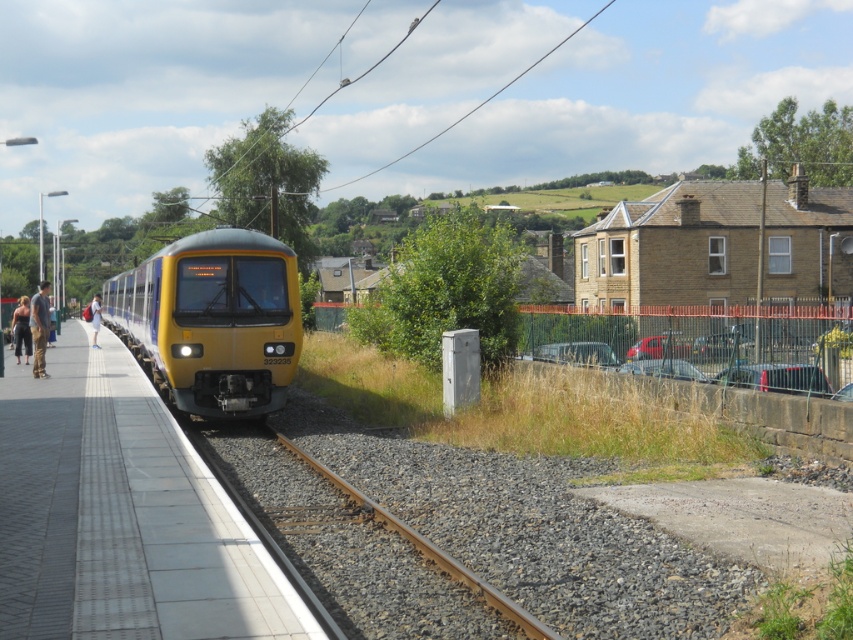
You are standing on the platform at the railway station and looking towards the train. There are two points marked on the platform, point (173, 465) and point (16, 333). Which point is closer to you?

Point (173, 465) is closer to you because it is closer to the camera than point (16, 333).

You are standing at the point marked by the coordinate point (213, 321) on the platform. Looking around, you see the yellow matte train at center. Which direction should you walk to board the train?

The point marked by the coordinate point (213, 321) is already at the yellow matte train at center, so you are already at the train and do not need to move.